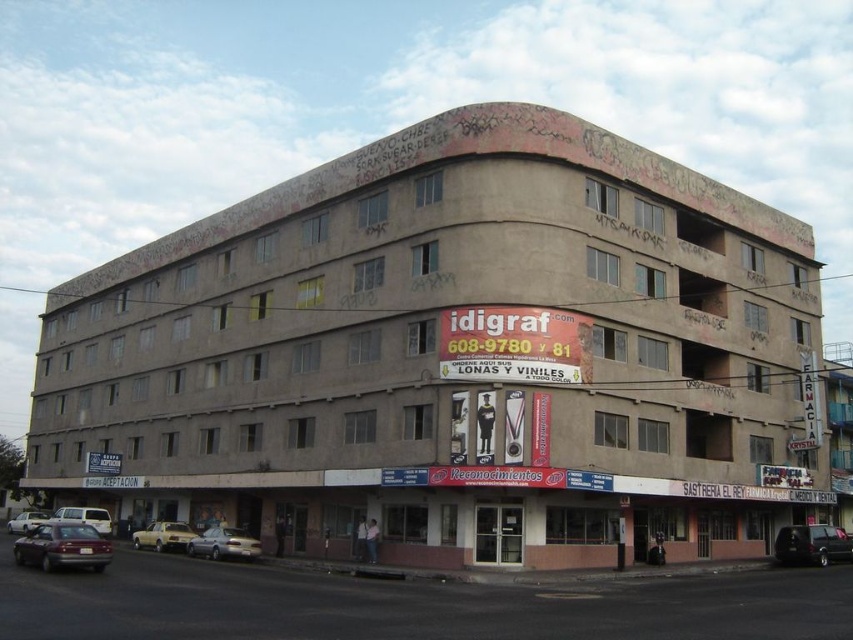
Is matte red car at lower left positioned before yellow matte car at lower left?

Yes, it is in front of yellow matte car at lower left.

Is matte red car at lower left bigger than yellow matte car at lower left?

Indeed, matte red car at lower left has a larger size compared to yellow matte car at lower left.

The width and height of the screenshot is (853, 640). I want to click on matte red car at lower left, so click(62, 547).

You are a GUI agent. You are given a task and a screenshot of the screen. Output one action in this format:
    pyautogui.click(x=<x>, y=<y>)
    Task: Click on the matte red car at lower left
    
    Given the screenshot: What is the action you would take?
    pyautogui.click(x=62, y=547)

Does yellow matte car at lower left have a greater width compared to white matte van at lower left?

No.

Based on the photo, is yellow matte car at lower left to the left of white matte van at lower left from the viewer's perspective?

Incorrect, yellow matte car at lower left is not on the left side of white matte van at lower left.

Image resolution: width=853 pixels, height=640 pixels. I want to click on yellow matte car at lower left, so click(163, 536).

Who is positioned more to the left, matte red car at lower left or satin silver sedan at lower center?

matte red car at lower left is more to the left.

Does point (55, 529) come farther from viewer compared to point (250, 557)?

No, it is not.

What are the coordinates of `matte red car at lower left` in the screenshot? It's located at (62, 547).